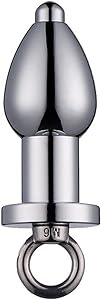
I want to click on top of this plug, so click(49, 3).